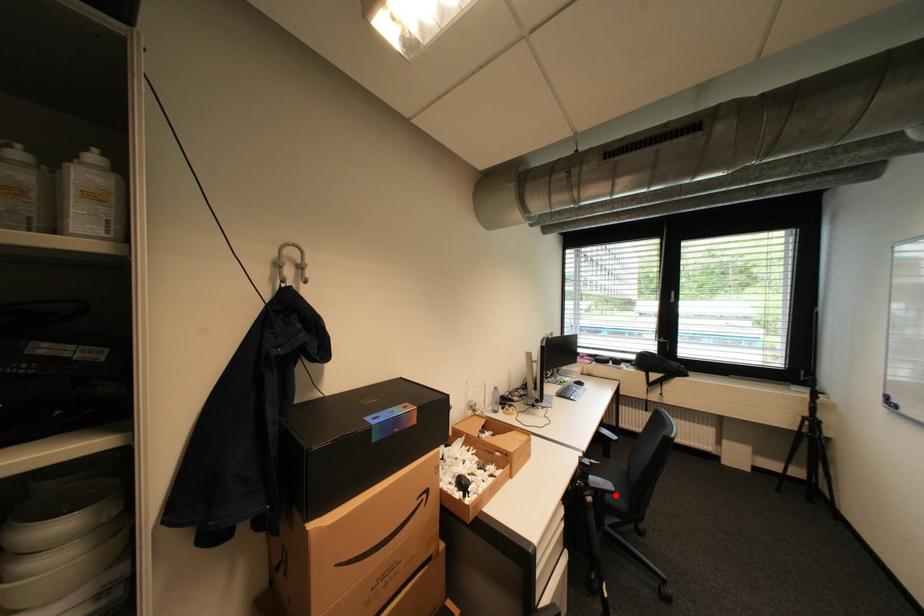
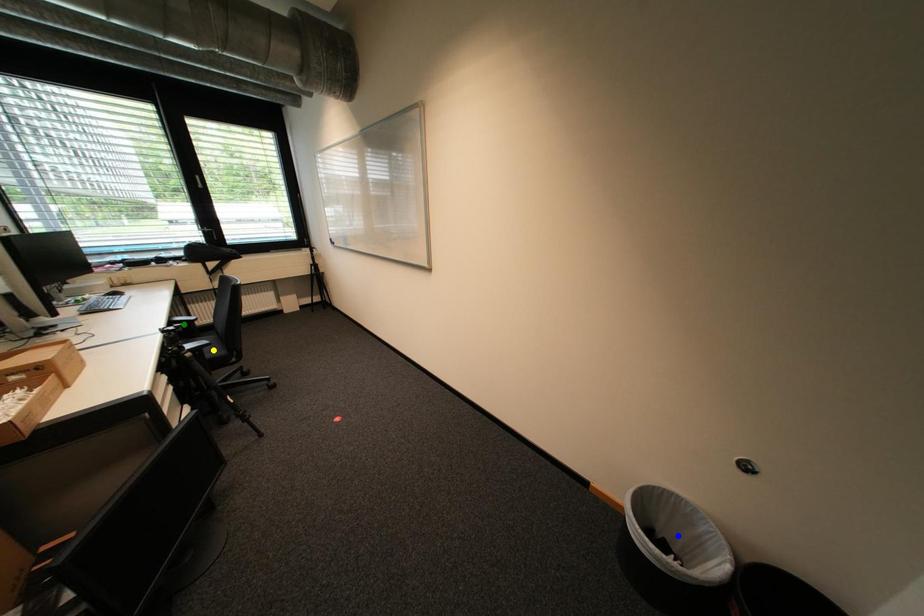
Question: I am providing you with two images of the same scene from different viewpoints. A red point is marked on the first image. You are given multiple points on the second image. Can you choose the point in image 2 that corresponds to the point in image 1?

Choices:
 (A) blue point
 (B) green point
 (C) yellow point

Answer: (C)